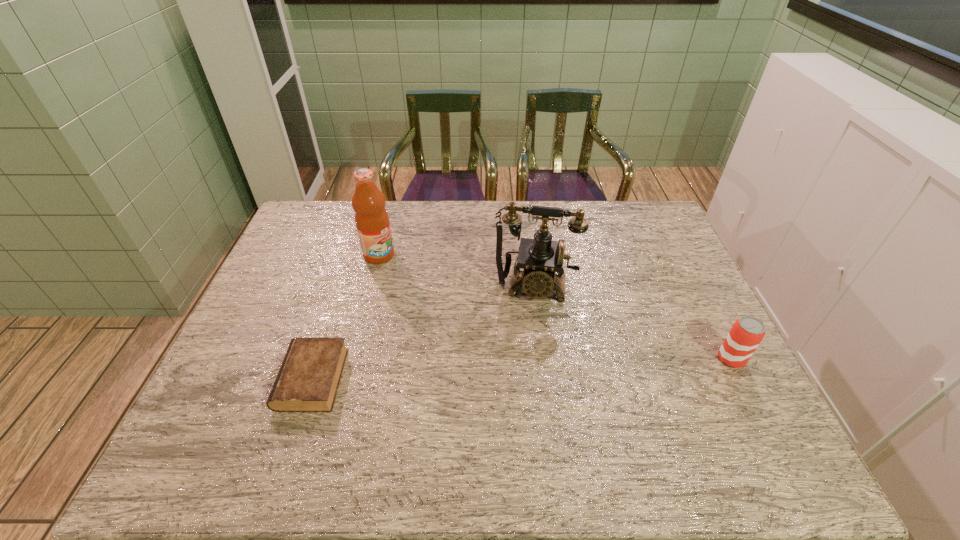
Locate an element on the screen. This screenshot has height=540, width=960. diary is located at coordinates (308, 379).

This screenshot has width=960, height=540. Find the location of `the third tallest object`. the third tallest object is located at coordinates (747, 332).

At what (x,y) coordinates should I click in order to perform the action: click on beer can. Please return your answer as a coordinate pair (x, y). Looking at the image, I should click on (747, 332).

At what (x,y) coordinates should I click in order to perform the action: click on fruit juice. Please return your answer as a coordinate pair (x, y). The width and height of the screenshot is (960, 540). Looking at the image, I should click on click(372, 222).

At what (x,y) coordinates should I click in order to perform the action: click on telephone. Please return your answer as a coordinate pair (x, y). Looking at the image, I should click on (540, 257).

You are a GUI agent. You are given a task and a screenshot of the screen. Output one action in this format:
    pyautogui.click(x=<x>, y=<y>)
    Task: Click on the second farthest object
    
    Given the screenshot: What is the action you would take?
    pyautogui.click(x=540, y=257)

The width and height of the screenshot is (960, 540). Find the location of `vacant space positioned on the spine side of the shortest object`. vacant space positioned on the spine side of the shortest object is located at coordinates (223, 379).

I want to click on blank area located on the spine side of the shortest object, so click(259, 379).

The height and width of the screenshot is (540, 960). Identify the location of free space located on the left of the third tallest object. (620, 359).

Image resolution: width=960 pixels, height=540 pixels. What are the coordinates of `blank area located on the front label of the fruit juice` in the screenshot? It's located at (437, 298).